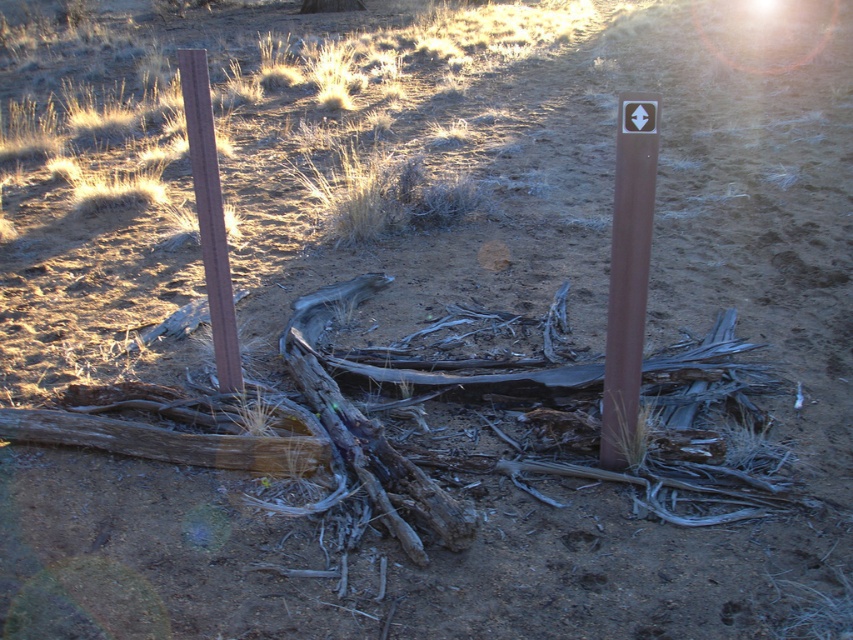
Question: Can you confirm if brown matte post at center is positioned below brown wood post at left?

Choices:
 (A) yes
 (B) no

Answer: (A)

Question: Which point is closer to the camera taking this photo?

Choices:
 (A) [207, 208]
 (B) [630, 272]

Answer: (B)

Question: Which of the following is the farthest from the observer?

Choices:
 (A) (636, 344)
 (B) (215, 193)

Answer: (B)

Question: Is brown matte post at center positioned behind brown wood post at left?

Choices:
 (A) yes
 (B) no

Answer: (B)

Question: From the image, what is the correct spatial relationship of brown matte post at center in relation to brown wood post at left?

Choices:
 (A) right
 (B) left

Answer: (A)